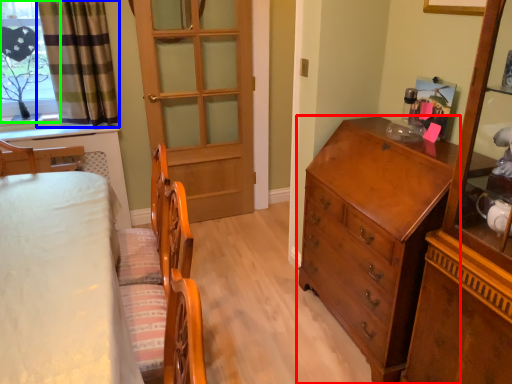
Question: Which is farther away from chest of drawers (highlighted by a red box)? curtain (highlighted by a blue box) or window (highlighted by a green box)?

Choices:
 (A) curtain
 (B) window

Answer: (B)